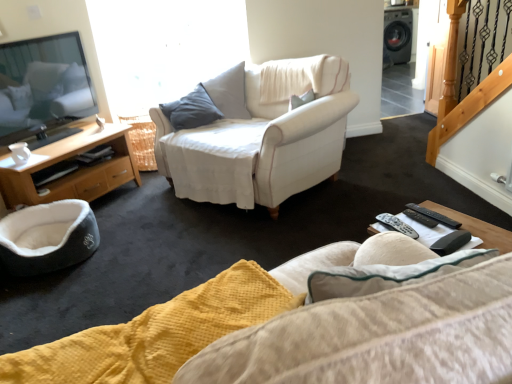
I want to click on vacant space to the right of dark gray plush pet bed at lower left, so click(130, 245).